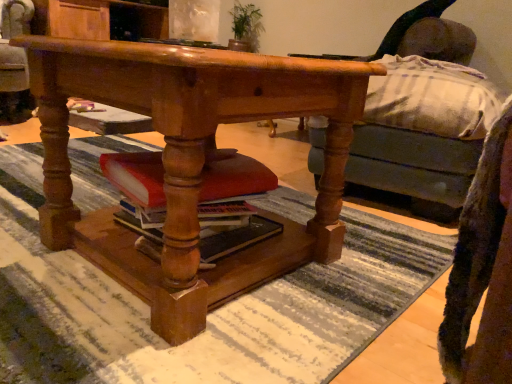
Question: Which is correct: wooden swivel chair at center is inside wooden desk at center, or outside of it?

Choices:
 (A) inside
 (B) outside

Answer: (B)

Question: Is wooden swivel chair at center to the left or to the right of wooden desk at center in the image?

Choices:
 (A) right
 (B) left

Answer: (B)

Question: Which object is positioned closest to the wooden swivel chair at center?

Choices:
 (A) matte red book at center
 (B) green leafy plant at upper center
 (C) wooden desk at center

Answer: (B)

Question: Estimate the real-world distances between objects in this image. Which object is closer to the wooden swivel chair at center?

Choices:
 (A) wooden desk at center
 (B) green leafy plant at upper center
 (C) matte red book at center

Answer: (B)